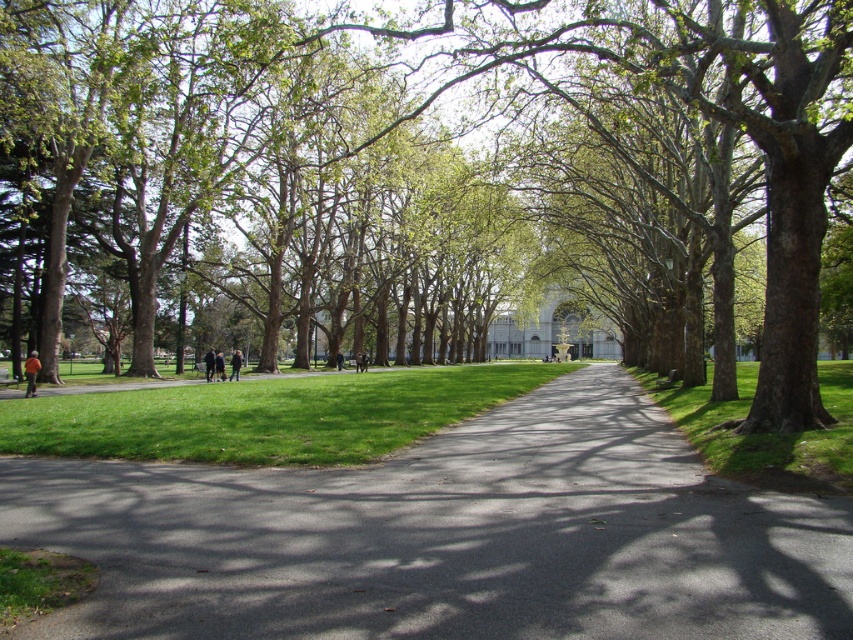
Question: Estimate the real-world distances between objects in this image. Which object is closer to the dark blue jeans at center?

Choices:
 (A) green leafy tree at center
 (B) green grass at right
 (C) black asphalt road at center

Answer: (A)

Question: Does black asphalt road at center have a greater width compared to green leafy tree at center?

Choices:
 (A) yes
 (B) no

Answer: (B)

Question: Based on their relative distances, which object is farther from the green grass at center?

Choices:
 (A) black asphalt road at center
 (B) dark gray jacket at center
 (C) dark blue jeans at center

Answer: (B)

Question: Which point is closer to the camera?

Choices:
 (A) (792, 381)
 (B) (32, 358)
 (C) (721, 406)

Answer: (A)

Question: Can you confirm if green leafy tree at center is bigger than orange fabric person at lower left?

Choices:
 (A) yes
 (B) no

Answer: (A)

Question: Can you confirm if orange fabric person at lower left is wider than dark brown leather jacket at center?

Choices:
 (A) yes
 (B) no

Answer: (A)